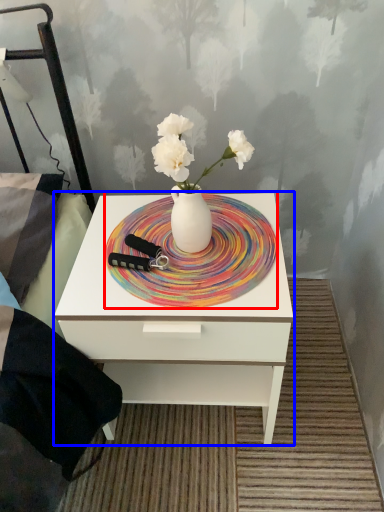
Question: Which object is further to the camera taking this photo, plate (highlighted by a red box) or nightstand (highlighted by a blue box)?

Choices:
 (A) plate
 (B) nightstand

Answer: (A)